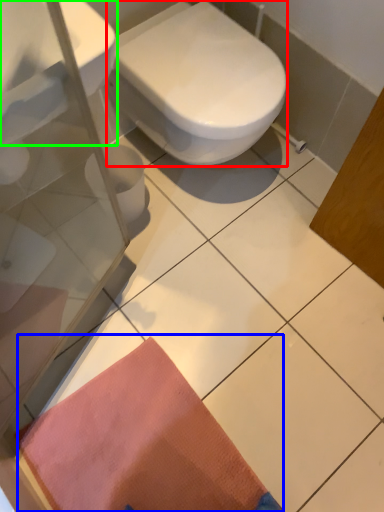
Question: Which is nearer to the bidet (highlighted by a red box)? doormat (highlighted by a blue box) or sink (highlighted by a green box).

Choices:
 (A) doormat
 (B) sink

Answer: (B)